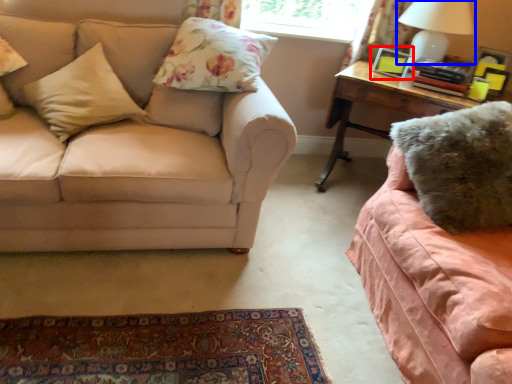
Question: Which object is further to the camera taking this photo, picture frame (highlighted by a red box) or table lamp (highlighted by a blue box)?

Choices:
 (A) picture frame
 (B) table lamp

Answer: (A)